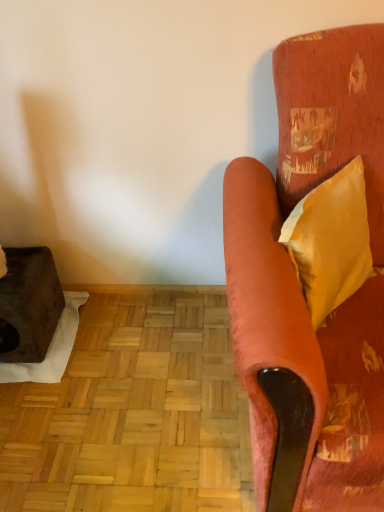
Question: Choose the correct answer: Is velvet orange couch at right inside yellow satin pillow at right or outside it?

Choices:
 (A) outside
 (B) inside

Answer: (A)

Question: Considering the positions of point (230, 220) and point (367, 230), is point (230, 220) closer or farther from the camera than point (367, 230)?

Choices:
 (A) farther
 (B) closer

Answer: (B)

Question: Is velvet orange couch at right to the left or to the right of yellow satin pillow at right in the image?

Choices:
 (A) left
 (B) right

Answer: (B)

Question: Choose the correct answer: Is yellow satin pillow at right inside velvet orange couch at right or outside it?

Choices:
 (A) outside
 (B) inside

Answer: (B)

Question: Is yellow satin pillow at right to the left or to the right of velvet orange couch at right in the image?

Choices:
 (A) left
 (B) right

Answer: (A)

Question: From a real-world perspective, relative to velvet orange couch at right, is yellow satin pillow at right vertically above or below?

Choices:
 (A) below
 (B) above

Answer: (B)

Question: Considering the positions of yellow satin pillow at right and velvet orange couch at right in the image, is yellow satin pillow at right taller or shorter than velvet orange couch at right?

Choices:
 (A) short
 (B) tall

Answer: (A)